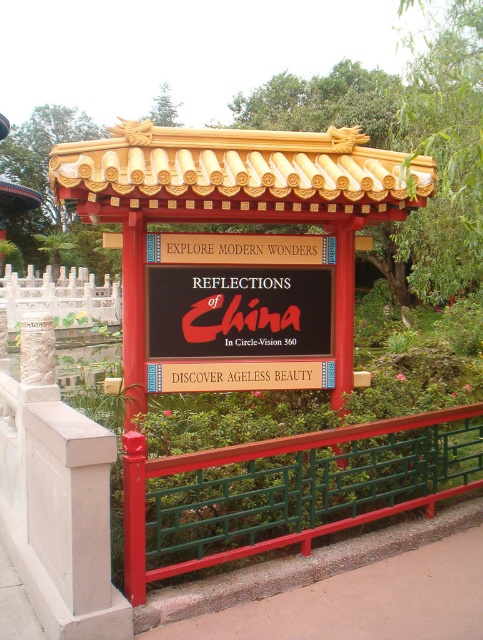
You are standing in front of the signboard and want to install a new decorative element exactly at the center of the green metal fence at center. According to the image, what are the coordinates where you should place it?

The 2D location of the green metal fence at center is at point (288, 486), so you should place the decorative element at those coordinates.

You are standing at the point marked by the coordinates point (241, 348). You want to take a photo of the signboard. Is the signboard in your line of sight? Explain why or why not.

The point marked by the coordinates point (241, 348) is 16.74 feet away from the viewer. Since the signboard is part of the scene described, and there is no mention of any obstruction between the viewer and the signboard, the signboard should be in your line of sight.